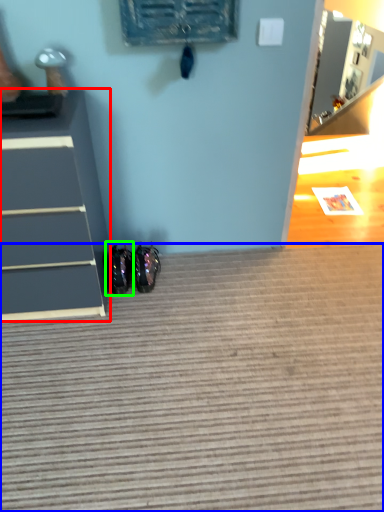
Question: Which object is the closest to the chest of drawers (highlighted by a red box)? Choose among these: doormat (highlighted by a blue box) or footwear (highlighted by a green box).

Choices:
 (A) doormat
 (B) footwear

Answer: (B)